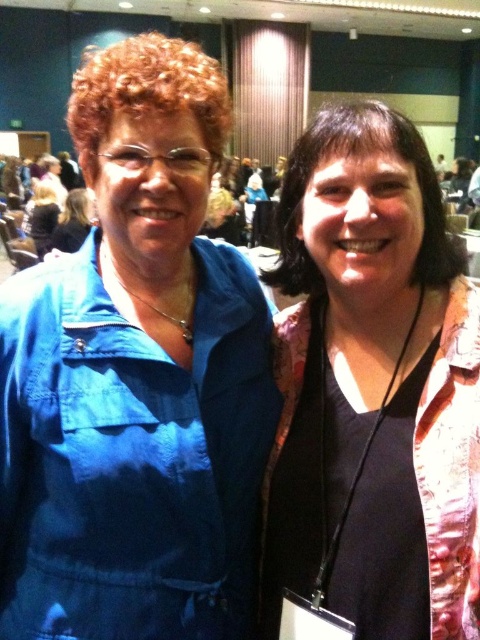
Question: Can you confirm if denim jacket at left is positioned above matte black shirt at center?

Choices:
 (A) yes
 (B) no

Answer: (A)

Question: Which point is closer to the camera taking this photo?

Choices:
 (A) (336, 310)
 (B) (127, 362)

Answer: (B)

Question: Is denim jacket at left below matte black shirt at center?

Choices:
 (A) yes
 (B) no

Answer: (B)

Question: Is denim jacket at left bigger than matte black shirt at center?

Choices:
 (A) no
 (B) yes

Answer: (B)